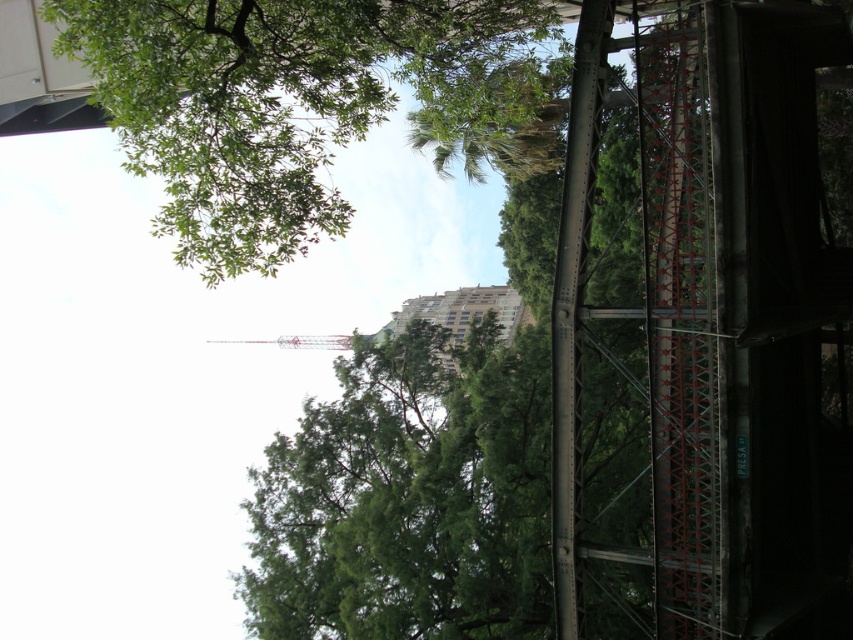
You are an urban planner reviewing this area. You need to decide if the green leafy tree at upper left can provide shade to the metallic pink tower at center during midday. Based on their positions, is this possible?

The green leafy tree at upper left is above the metallic pink tower at center, so it can cast shade over the tower during midday when the sun is overhead.

You are standing on the metal bridge and want to know the distance between the green leafy tree at upper left and the metallic pink tower at center. Can you estimate how far apart they are?

The green leafy tree at upper left and the metallic pink tower at center are 44.81 feet apart.

You are a photographer trying to capture both the green leafy tree at upper left and the metallic pink tower at center in your shot. Based on their sizes in the image, which object would you need to frame more tightly to ensure both fit in the photo?

The green leafy tree at upper left has a lesser width compared to the metallic pink tower at center, so you should frame the metallic pink tower at center more tightly since it is wider and requires more space in the photo to fit properly.